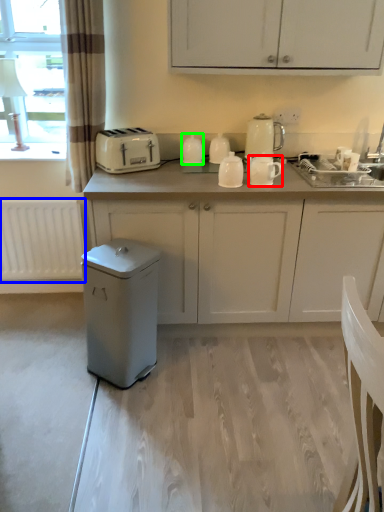
Question: Which object is positioned farthest from kitchen appliance (highlighted by a red box)? Select from radiator (highlighted by a blue box) and kitchen appliance (highlighted by a green box).

Choices:
 (A) radiator
 (B) kitchen appliance

Answer: (A)